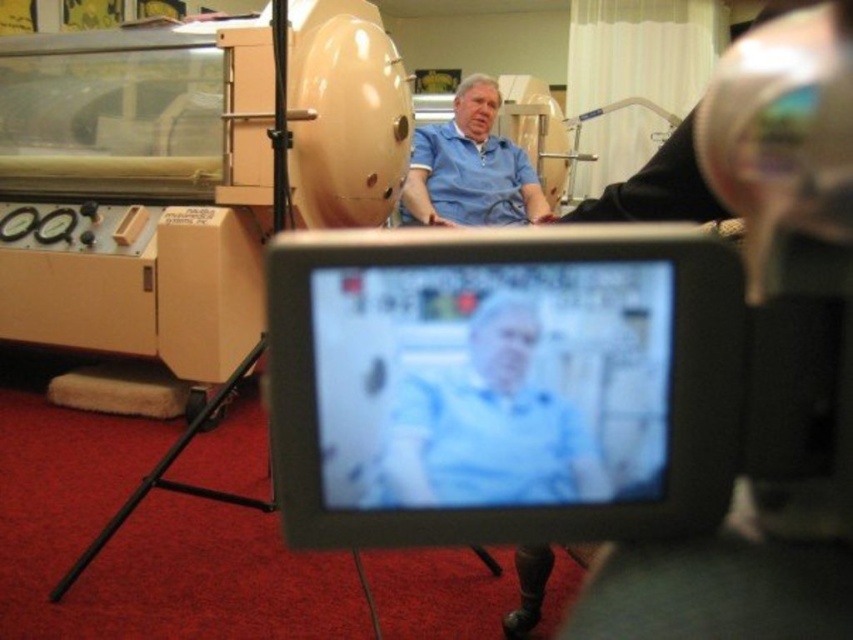
You are an assistant in a lab and need to determine which item is shorter between the blue fabric at center and the blue smooth shirt at center. Can you identify the shorter one?

The blue fabric at center is shorter than the blue smooth shirt at center, so the blue fabric at center is the shorter one.

From the picture: You are an assistant in a lab and need to determine which object is closer to you. You see the blue fabric at center and the blue smooth shirt at center. Which one is closer?

The blue fabric at center is closer because it is in front of the blue smooth shirt at center.

You are an assistant in a medical lab and need to determine which item is more suitable for covering a sensitive electronic device. The blue fabric at center and the blue smooth shirt at center are available. Which one would you choose and why?

The blue fabric at center is thinner than the blue smooth shirt at center, so the blue fabric at center would be more suitable for covering a sensitive electronic device because its thinner material allows better airflow and reduces the risk of overheating.